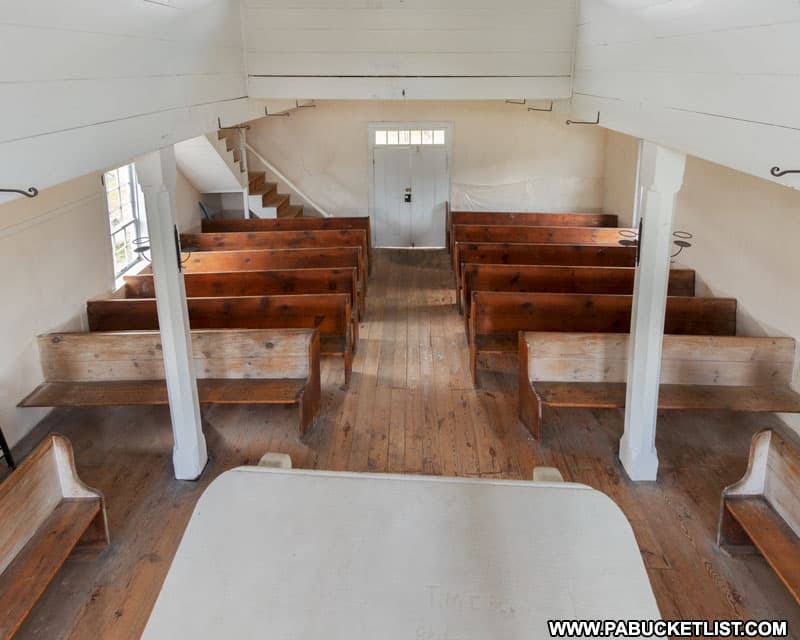
Where is `wall`? The image size is (800, 640). wall is located at coordinates (76, 258), (490, 146), (726, 236).